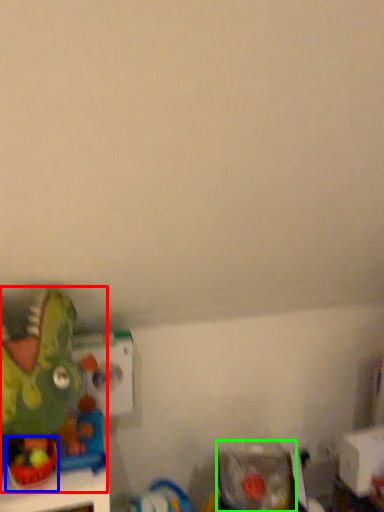
Question: Considering the real-world distances, which object is closest to toy (highlighted by a red box)? toy (highlighted by a blue box) or toy (highlighted by a green box).

Choices:
 (A) toy
 (B) toy

Answer: (A)